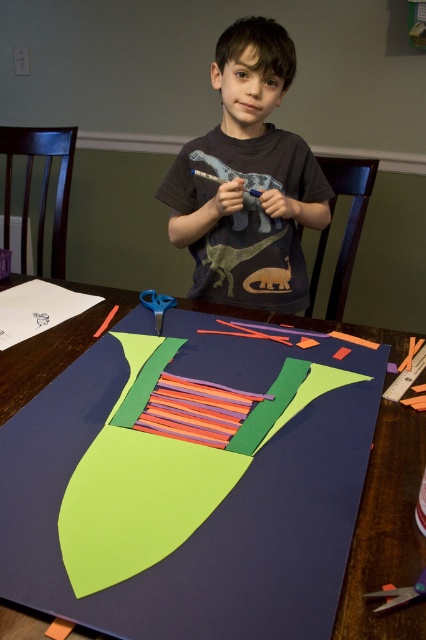
Which is more to the left, dark gray t-shirt at center or blue plastic scissors at upper center?

blue plastic scissors at upper center is more to the left.

At what (x,y) coordinates should I click in order to perform the action: click on dark gray t-shirt at center. Please return your answer as a coordinate pair (x, y). Image resolution: width=426 pixels, height=640 pixels. Looking at the image, I should click on (247, 180).

Is dark gray t-shirt at center positioned at the back of metallic silver scissors at lower right?

Yes, it is behind metallic silver scissors at lower right.

Between dark gray t-shirt at center and metallic silver scissors at lower right, which one is positioned lower?

Positioned lower is metallic silver scissors at lower right.

Does point (316, 170) lie behind point (402, 600)?

Yes, point (316, 170) is behind point (402, 600).

You are a GUI agent. You are given a task and a screenshot of the screen. Output one action in this format:
    pyautogui.click(x=<x>, y=<y>)
    Task: Click on the dark gray t-shirt at center
    Image resolution: width=426 pixels, height=640 pixels.
    Given the screenshot: What is the action you would take?
    pyautogui.click(x=247, y=180)

The height and width of the screenshot is (640, 426). Find the location of `dark gray t-shirt at center`. dark gray t-shirt at center is located at coordinates click(x=247, y=180).

Between dark gray t-shirt at center and matte blue paper at center, which one appears on the left side from the viewer's perspective?

matte blue paper at center is more to the left.

Which is behind, point (278, 180) or point (339, 612)?

Positioned behind is point (278, 180).

Identify the location of dark gray t-shirt at center. (247, 180).